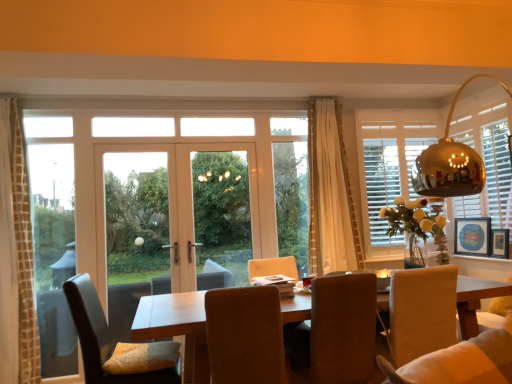
Question: Can you confirm if clear glass window at left is smaller than wooden picture frame at right, which is counted as the 1th picture frame, starting from the front?

Choices:
 (A) yes
 (B) no

Answer: (B)

Question: From the image's perspective, is clear glass window at left above wooden picture frame at right, which is counted as the 1th picture frame, starting from the front?

Choices:
 (A) yes
 (B) no

Answer: (A)

Question: Considering the relative positions of clear glass window at left and wooden picture frame at right, which is counted as the 1th picture frame, starting from the front, in the image provided, is clear glass window at left to the left of wooden picture frame at right, which is counted as the 1th picture frame, starting from the front, from the viewer's perspective?

Choices:
 (A) no
 (B) yes

Answer: (B)

Question: Is clear glass window at left in contact with wooden picture frame at right, placed as the 2th picture frame when sorted from back to front?

Choices:
 (A) no
 (B) yes

Answer: (A)

Question: Does clear glass window at left come in front of wooden picture frame at right, which is counted as the 1th picture frame, starting from the front?

Choices:
 (A) no
 (B) yes

Answer: (B)

Question: Looking at their shapes, would you say white wood screen door at center is wider or thinner than white textured curtain at left, the 1th curtain from the front?

Choices:
 (A) thin
 (B) wide

Answer: (A)

Question: From a real-world perspective, is white wood screen door at center positioned above or below white textured curtain at left, the first curtain viewed from the left?

Choices:
 (A) above
 (B) below

Answer: (A)

Question: Is point (205, 190) closer or farther from the camera than point (19, 306)?

Choices:
 (A) closer
 (B) farther

Answer: (B)

Question: Based on their positions, is white wood screen door at center located to the left or right of white textured curtain at left, the first curtain viewed from the left?

Choices:
 (A) left
 (B) right

Answer: (B)

Question: In the image, is suede-like brown chair at center, arranged as the 2th chair when viewed from the left, on the left side or the right side of wooden picture frame at right, placed as the 2th picture frame when sorted from back to front?

Choices:
 (A) left
 (B) right

Answer: (A)

Question: From the image's perspective, is suede-like brown chair at center, positioned as the 2th chair in right-to-left order, above or below wooden picture frame at right, placed as the 2th picture frame when sorted from back to front?

Choices:
 (A) above
 (B) below

Answer: (B)

Question: Is suede-like brown chair at center, positioned as the 2th chair in right-to-left order, bigger or smaller than wooden picture frame at right, placed as the 2th picture frame when sorted from back to front?

Choices:
 (A) big
 (B) small

Answer: (A)

Question: From a real-world perspective, is suede-like brown chair at center, positioned as the 2th chair in right-to-left order, positioned above or below wooden picture frame at right, placed as the 2th picture frame when sorted from back to front?

Choices:
 (A) above
 (B) below

Answer: (B)

Question: Is point (239, 337) positioned closer to the camera than point (348, 317)?

Choices:
 (A) farther
 (B) closer

Answer: (B)

Question: From the image's perspective, is suede-like brown chair at center, positioned as the 2th chair in right-to-left order, positioned above or below brown fabric chair at center, which is the third chair from left to right?

Choices:
 (A) above
 (B) below

Answer: (B)